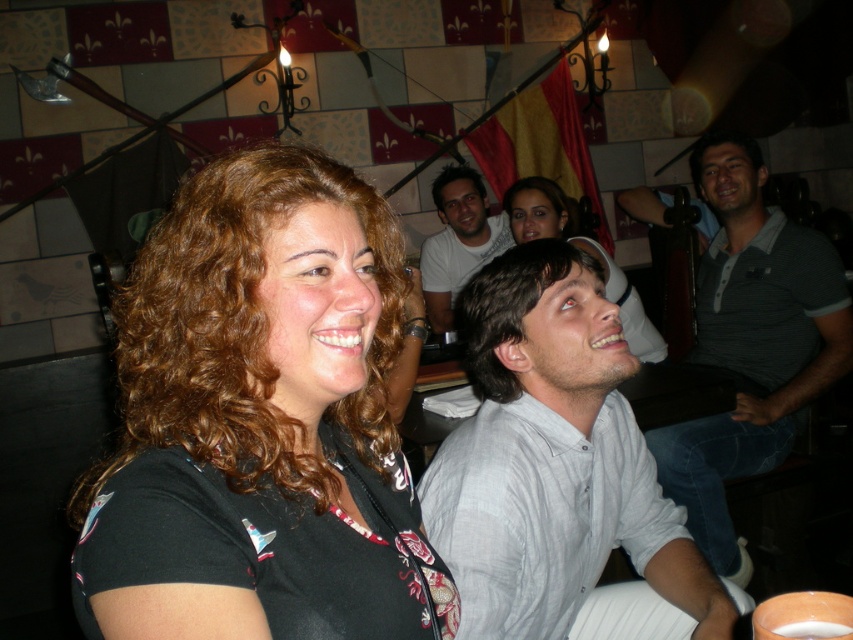
You are a photographer standing at the center of the room. You want to take a photo that includes both the brown curly hair at left and the dark brown curly hair at upper right. However, your camera has a maximum focus range of 6 feet. Will you be able to capture both subjects in focus?

The brown curly hair at left is 5.97 feet away from the dark brown curly hair at upper right. Since the distance between them is within the camera maximum focus range of 6 feet, you can capture both subjects in focus.

You are at the themed restaurant and need to identify which object is taller between the gray striped polo shirt at upper right and the dark brown curly hair at upper right. Based on the scene description, which one is taller?

The gray striped polo shirt at upper right is taller than the dark brown curly hair at upper right according to the description.

You are taking a photo of the lively social gathering in the themed restaurant. You want to focus on the two foreground individuals. Which of the two points, point (325, 506) or point (698, 173), is closer to your camera lens?

Point (325, 506) is closer to the camera lens than point (698, 173).